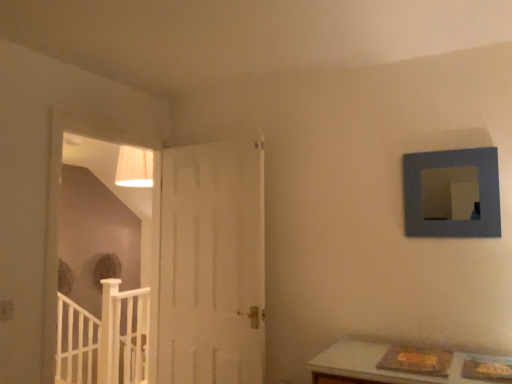
Question: Is white wooden rail at lower left to the right of white wood door at left from the viewer's perspective?

Choices:
 (A) no
 (B) yes

Answer: (A)

Question: Does white wooden rail at lower left have a greater height compared to white wood door at left?

Choices:
 (A) no
 (B) yes

Answer: (A)

Question: Can you confirm if white wooden rail at lower left is bigger than white wood door at left?

Choices:
 (A) yes
 (B) no

Answer: (A)

Question: Is white wooden rail at lower left positioned behind white wood door at left?

Choices:
 (A) yes
 (B) no

Answer: (A)

Question: From the image's perspective, is white wooden rail at lower left located beneath white wood door at left?

Choices:
 (A) yes
 (B) no

Answer: (A)

Question: Is white wooden rail at lower left looking in the opposite direction of white wood door at left?

Choices:
 (A) yes
 (B) no

Answer: (B)

Question: Is blue matte picture frame at upper right at the right side of white wood door at left?

Choices:
 (A) no
 (B) yes

Answer: (B)

Question: Can you confirm if blue matte picture frame at upper right is shorter than white wood door at left?

Choices:
 (A) yes
 (B) no

Answer: (A)

Question: Does blue matte picture frame at upper right lie behind white wood door at left?

Choices:
 (A) yes
 (B) no

Answer: (B)

Question: Is blue matte picture frame at upper right oriented away from white wood door at left?

Choices:
 (A) yes
 (B) no

Answer: (B)

Question: Is blue matte picture frame at upper right surrounding white wood door at left?

Choices:
 (A) no
 (B) yes

Answer: (A)

Question: Could you tell me if blue matte picture frame at upper right is facing white wood door at left?

Choices:
 (A) yes
 (B) no

Answer: (B)

Question: Is white wood door at left not within white wooden rail at lower left?

Choices:
 (A) no
 (B) yes

Answer: (B)